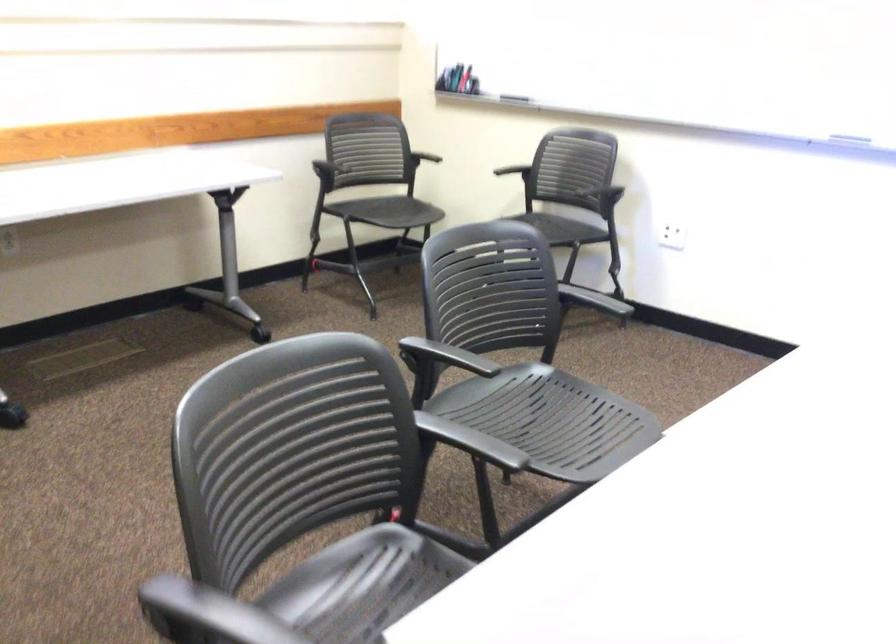
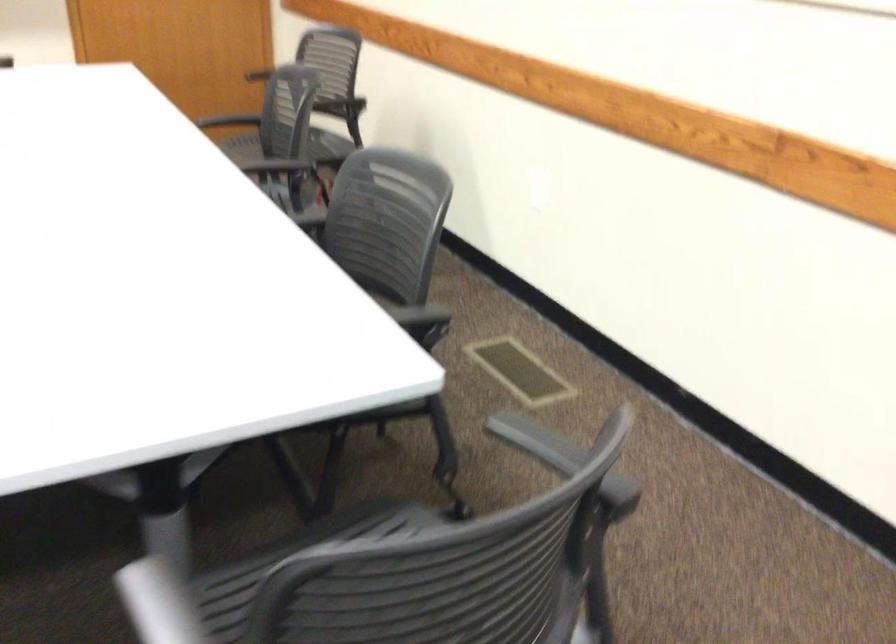
Locate, in the second image, the point that corresponds to point 503,458 in the first image.

(158, 603)